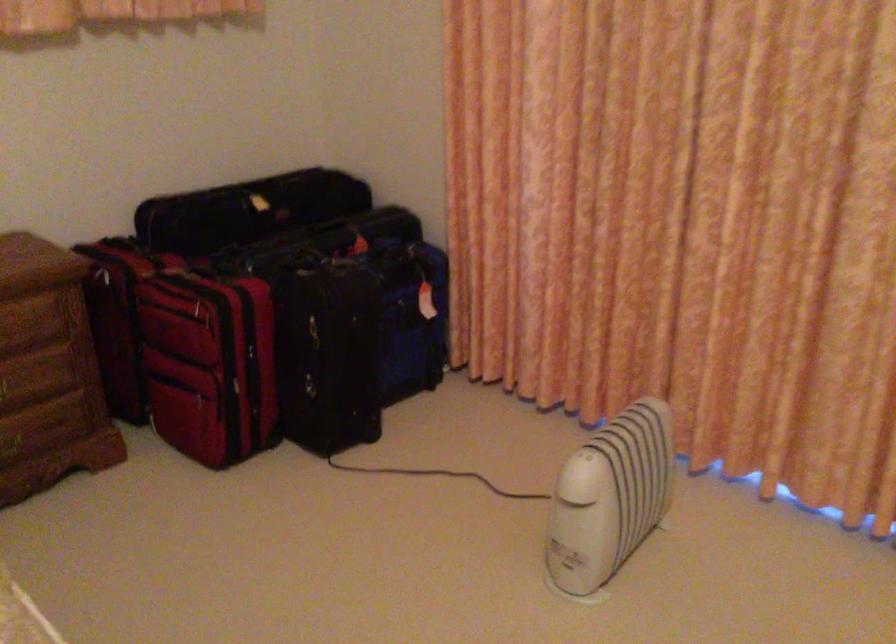
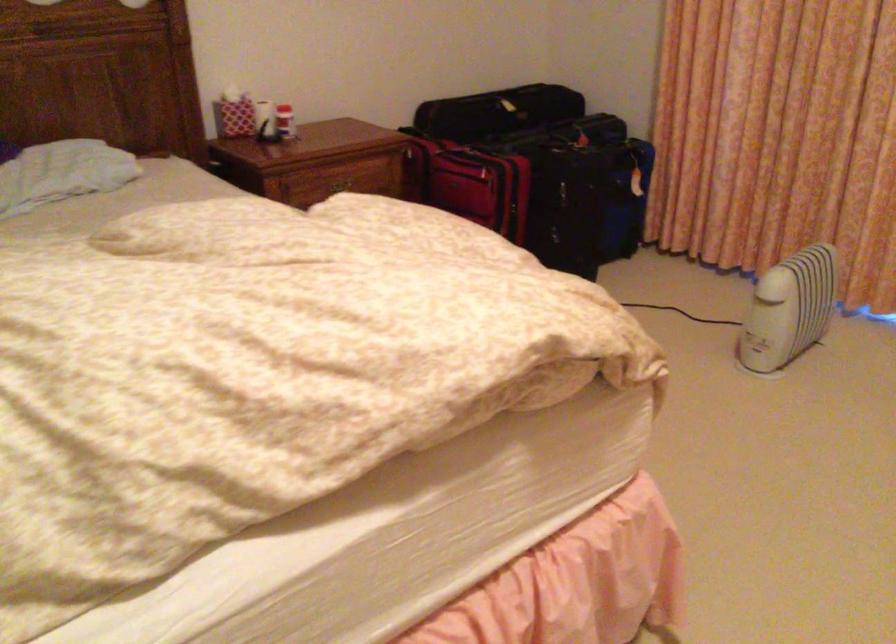
Where in the second image is the point corresponding to [323,353] from the first image?

(566, 205)